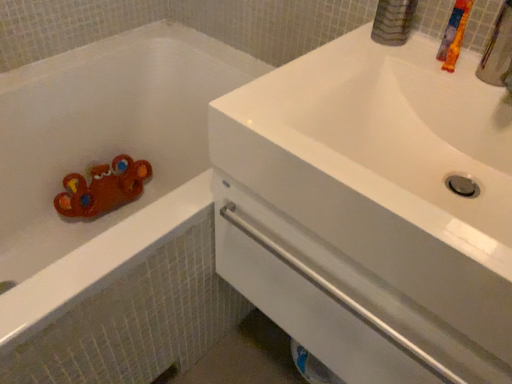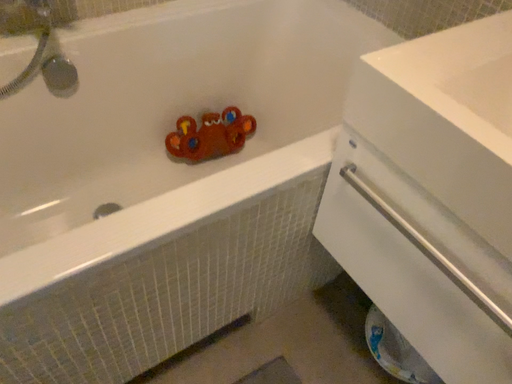
Question: How did the camera likely rotate when shooting the video?

Choices:
 (A) rotated right
 (B) rotated left

Answer: (B)